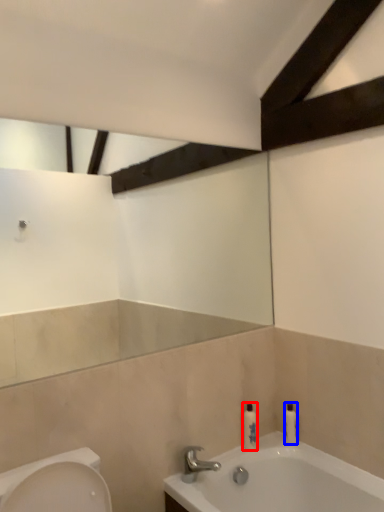
Question: Which object is further to the camera taking this photo, toiletry (highlighted by a red box) or toiletry (highlighted by a blue box)?

Choices:
 (A) toiletry
 (B) toiletry

Answer: (B)